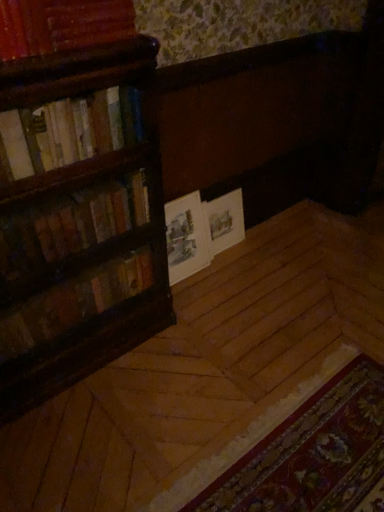
In order to click on unoccupied region to the right of white paper at center in this screenshot , I will do `click(226, 278)`.